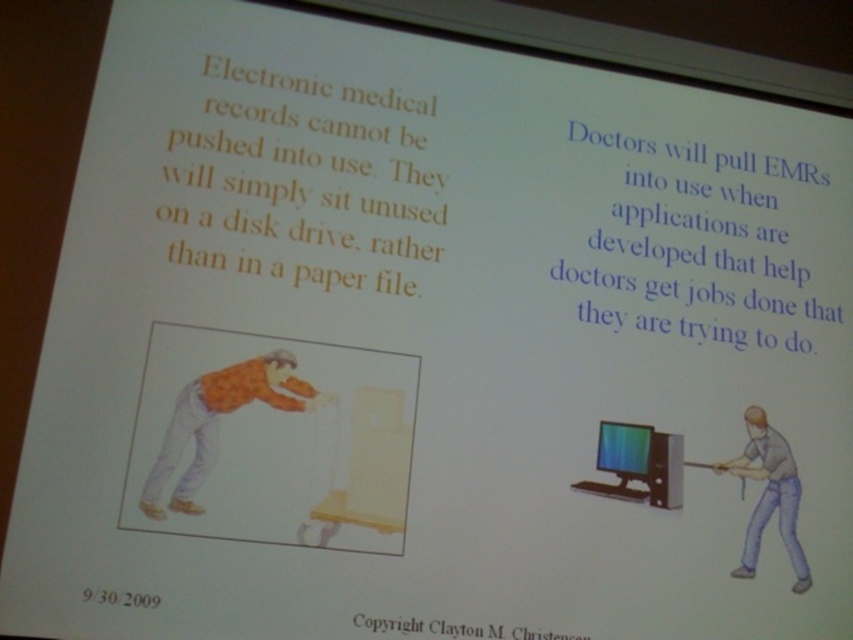
Who is higher up, orange printed shirt at lower left or gray matte shirt at center right?

orange printed shirt at lower left is higher up.

Who is lower down, orange printed shirt at lower left or gray matte shirt at center right?

gray matte shirt at center right is lower down.

Which is in front, point (196, 442) or point (746, 417)?

Positioned in front is point (196, 442).

Where is `orange printed shirt at lower left`? This screenshot has height=640, width=853. orange printed shirt at lower left is located at coordinates (218, 422).

Can you confirm if gray matte shirt at center right is shorter than matte black monitor at center?

Incorrect, gray matte shirt at center right's height does not fall short of matte black monitor at center's.

Which of these two, gray matte shirt at center right or matte black monitor at center, stands taller?

gray matte shirt at center right is taller.

Is point (792, 544) farther from camera compared to point (636, 436)?

No, it is not.

Where is `gray matte shirt at center right`? gray matte shirt at center right is located at coordinates (769, 493).

Is orange printed shirt at lower left bigger than matte black monitor at center?

Indeed, orange printed shirt at lower left has a larger size compared to matte black monitor at center.

Is orange printed shirt at lower left to the right of matte black monitor at center from the viewer's perspective?

In fact, orange printed shirt at lower left is to the left of matte black monitor at center.

Where is `orange printed shirt at lower left`? orange printed shirt at lower left is located at coordinates (218, 422).